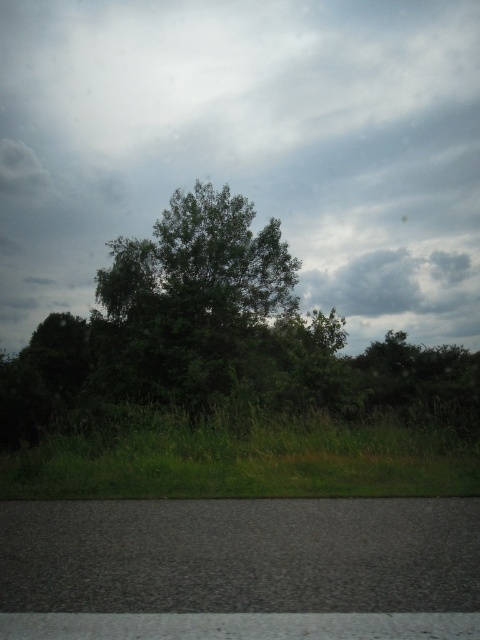
Question: Which point is closer to the camera?

Choices:
 (A) cloudy sky at upper center
 (B) green leafy tree at center
 (C) green grass at lower center

Answer: (C)

Question: Among these points, which one is farthest from the camera?

Choices:
 (A) (131, 236)
 (B) (289, 387)
 (C) (37, 467)

Answer: (A)

Question: Which object is the farthest from the green grass at lower center?

Choices:
 (A) green leafy tree at center
 (B) cloudy sky at upper center

Answer: (B)

Question: Observing the image, what is the correct spatial positioning of green leafy tree at center in reference to green grass at lower center?

Choices:
 (A) above
 (B) below

Answer: (A)

Question: Does cloudy sky at upper center appear on the left side of green grass at lower center?

Choices:
 (A) yes
 (B) no

Answer: (B)

Question: Is cloudy sky at upper center smaller than green grass at lower center?

Choices:
 (A) yes
 (B) no

Answer: (B)